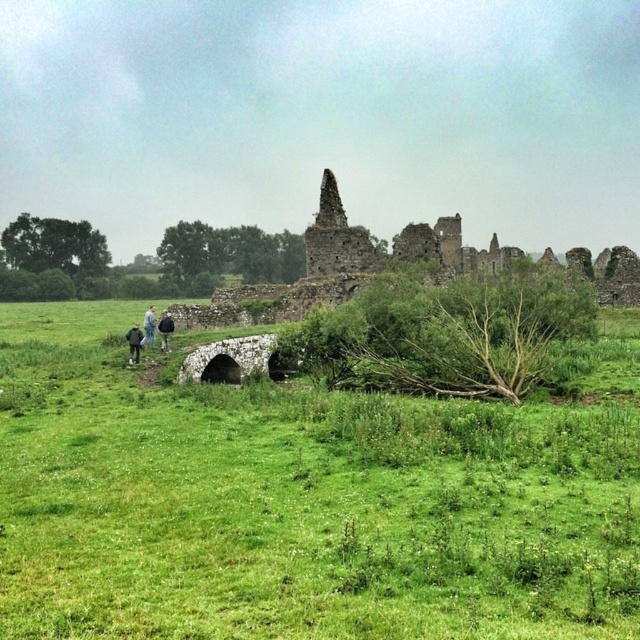
Question: Is camouflage jacket at left bigger than dark blue jeans at lower left?

Choices:
 (A) yes
 (B) no

Answer: (A)

Question: Which object is positioned farthest from the dark blue jeans at left?

Choices:
 (A) green grassy field at center
 (B) camouflage jacket at left
 (C) dark blue jeans at lower left

Answer: (A)

Question: Is green grassy field at center to the left of dark blue jeans at left from the viewer's perspective?

Choices:
 (A) no
 (B) yes

Answer: (A)

Question: Among these objects, which one is farthest from the camera?

Choices:
 (A) green grassy field at center
 (B) camouflage jacket at left
 (C) dark blue jeans at left
 (D) dark blue jeans at lower left

Answer: (C)

Question: Which object is closer to the camera taking this photo?

Choices:
 (A) dark blue jeans at left
 (B) green grassy field at center

Answer: (B)

Question: Is green grassy field at center above dark blue jeans at lower left?

Choices:
 (A) yes
 (B) no

Answer: (B)